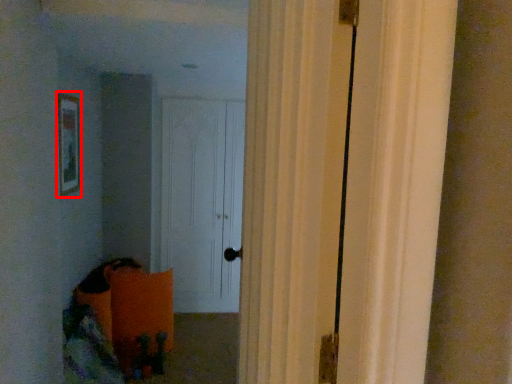
Question: From the image's perspective, considering the relative positions of picture frame (annotated by the red box) and door in the image provided, where is picture frame (annotated by the red box) located with respect to the staircase?

Choices:
 (A) above
 (B) below

Answer: (A)